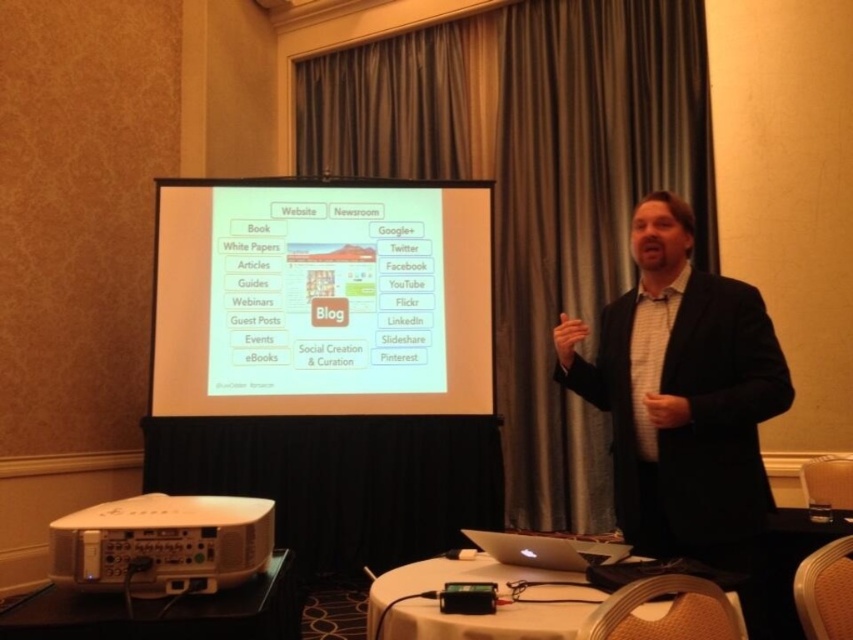
Between point (679, 284) and point (578, 614), which one is positioned behind?

Point (679, 284)

Who is positioned more to the right, black textured suit at center or white plastic table at lower center?

black textured suit at center is more to the right.

Between point (706, 298) and point (454, 628), which one is positioned in front?

Point (454, 628) is more forward.

Where is `black textured suit at center`? The image size is (853, 640). black textured suit at center is located at coordinates (682, 396).

Is point (749, 449) less distant than point (194, 566)?

No.

Who is higher up, black textured suit at center or white plastic projector at lower left?

black textured suit at center

This screenshot has width=853, height=640. I want to click on black textured suit at center, so click(x=682, y=396).

Which is behind, point (256, 522) or point (563, 589)?

Positioned behind is point (563, 589).

Does white plastic projector at lower left have a lesser height compared to white plastic table at lower center?

Correct, white plastic projector at lower left is not as tall as white plastic table at lower center.

Is point (62, 516) in front of point (485, 563)?

No, it is not.

In order to click on white plastic projector at lower left in this screenshot , I will do click(161, 544).